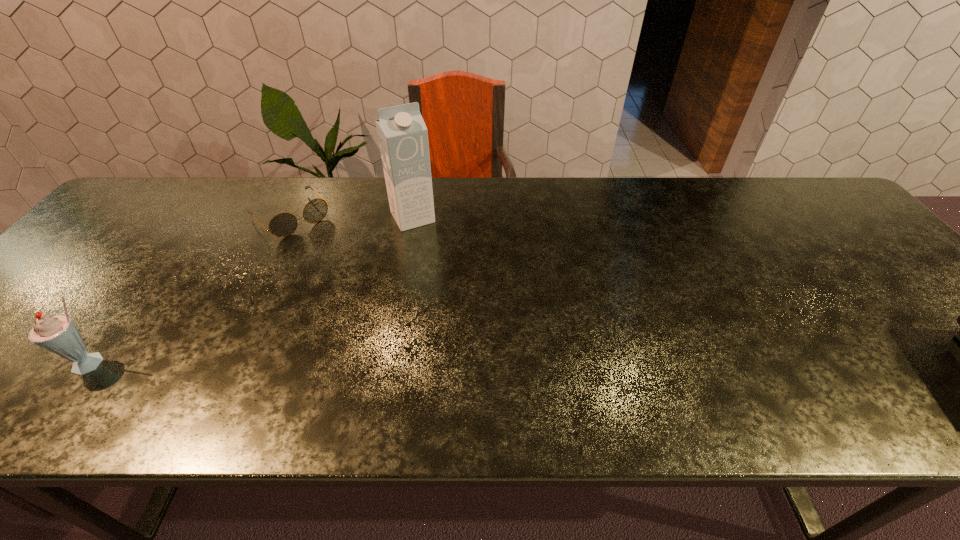
You are a GUI agent. You are given a task and a screenshot of the screen. Output one action in this format:
    pyautogui.click(x=<x>, y=<y>)
    Task: Click on the vacant spot on the desktop that is between the second shortest object and the rightmost object and is positioned on the front label of the tallest object
    
    Given the screenshot: What is the action you would take?
    pyautogui.click(x=502, y=369)

Where is `vacant space on the desktop that is between the milkshake and the camcorder and is positioned on the lenses of the sunglasses`? vacant space on the desktop that is between the milkshake and the camcorder and is positioned on the lenses of the sunglasses is located at coordinates (444, 368).